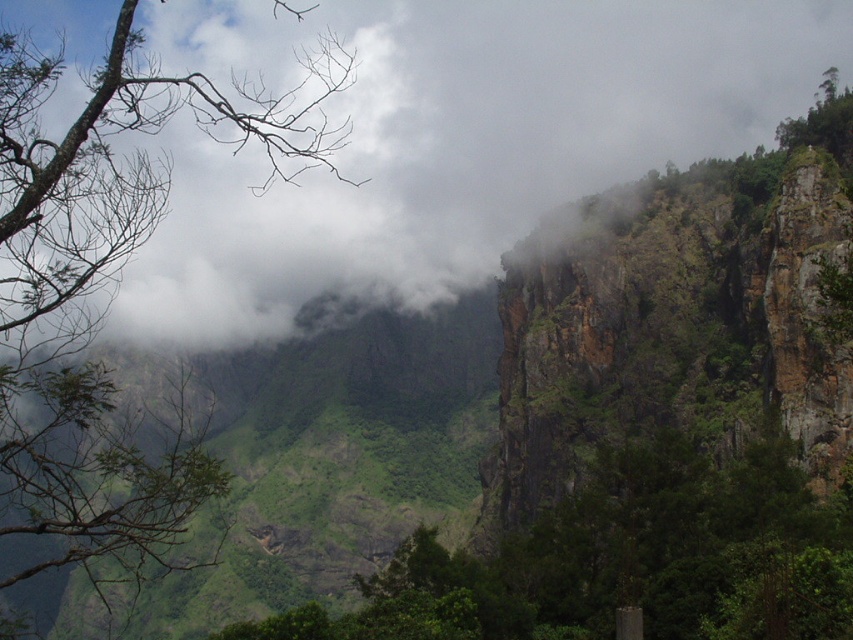
Can you confirm if white fluffy cloud at upper left is positioned to the right of green leafy tree at center?

Incorrect, white fluffy cloud at upper left is not on the right side of green leafy tree at center.

Identify the location of white fluffy cloud at upper left. (450, 138).

Between green leafy tree at upper left and green leafy tree at center, which one is positioned lower?

green leafy tree at center is below.

Is green leafy tree at upper left positioned before green leafy tree at center?

Yes, it is in front of green leafy tree at center.

Does point (248, 97) come closer to viewer compared to point (381, 572)?

No.

Find the location of a particular element. green leafy tree at upper left is located at coordinates (108, 294).

Is white fluffy cloud at upper left positioned at the back of green leafy tree at upper left?

Yes, it is behind green leafy tree at upper left.

Is white fluffy cloud at upper left wider than green leafy tree at upper left?

Result: Correct, the width of white fluffy cloud at upper left exceeds that of green leafy tree at upper left.

Describe the element at coordinates (450, 138) in the screenshot. The image size is (853, 640). I see `white fluffy cloud at upper left` at that location.

Locate an element on the screen. The height and width of the screenshot is (640, 853). white fluffy cloud at upper left is located at coordinates click(x=450, y=138).